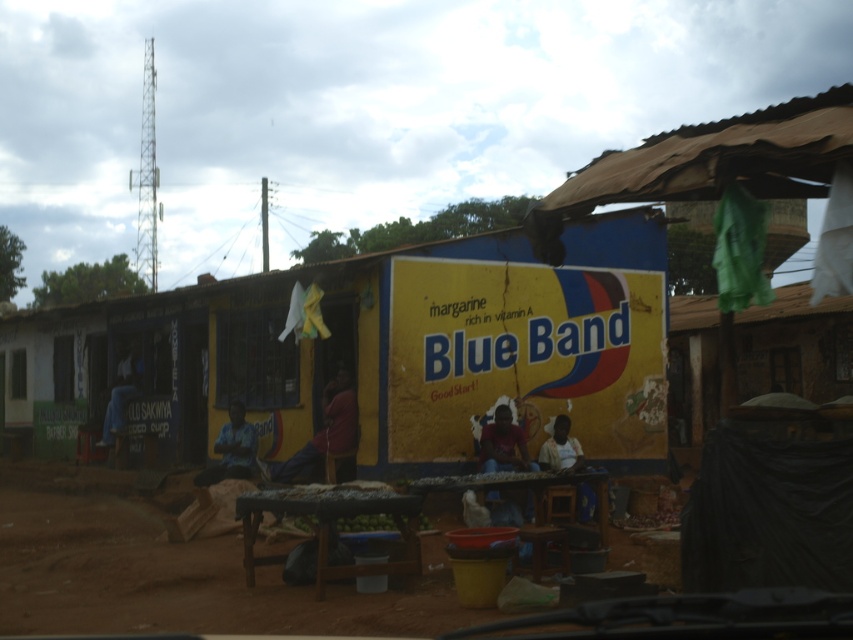
You are a vendor at the market and need to decide which shirt to display first. If the matte red shirt at center is wider than the blue fabric shirt at left, which one should you choose to place on the display rack first to maximize visibility?

The matte red shirt at center is wider than the blue fabric shirt at left, so you should place the matte red shirt at center first to maximize visibility.